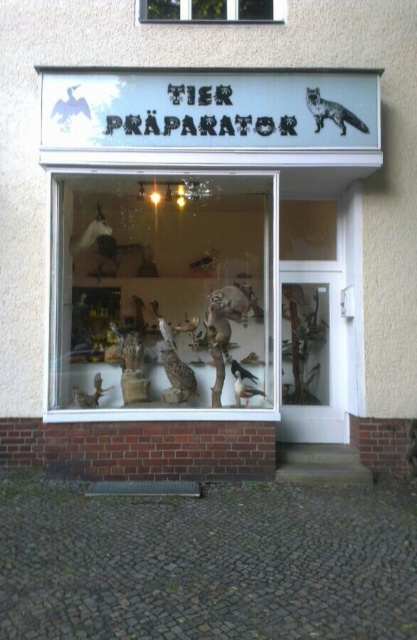
You are a customer in the taxidermy shop and want to place a new display between the matte plastic animal figures at center and the wooden display case at center. Which side should you place it on to ensure it fits without overlapping?

The matte plastic animal figures at center are wider than the wooden display case at center. To place a new display between them without overlapping, you should position it on the side of the wooden display case at center since it has more space available.

You are a customer looking to purchase a display item for a small shelf. You see the matte plastic animal figures at center and the wooden display case at center in the store window. Which item would you choose if you want something taller than the other?

The matte plastic animal figures at center has a greater height compared to the wooden display case at center, so you should choose the matte plastic animal figures at center if you want something taller.